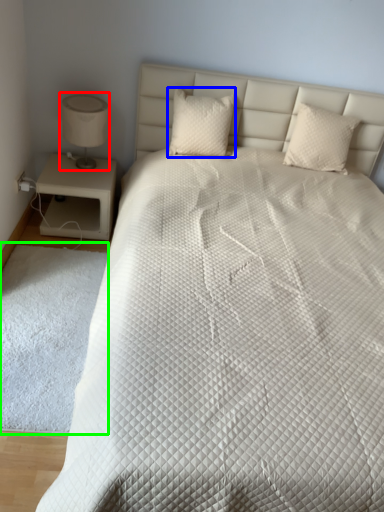
Question: Which object is positioned closest to table lamp (highlighted by a red box)? Select from pillow (highlighted by a blue box) and mat (highlighted by a green box).

Choices:
 (A) pillow
 (B) mat

Answer: (A)